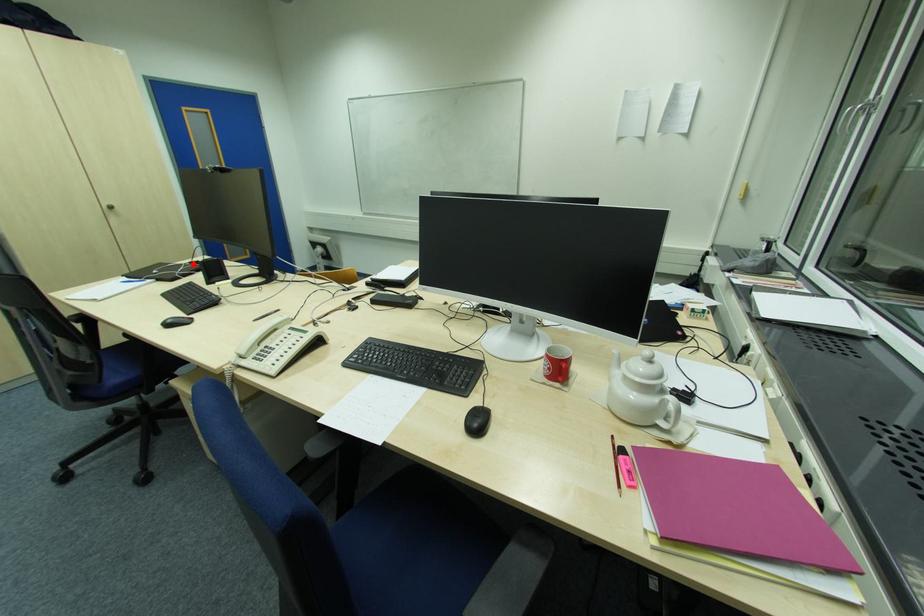
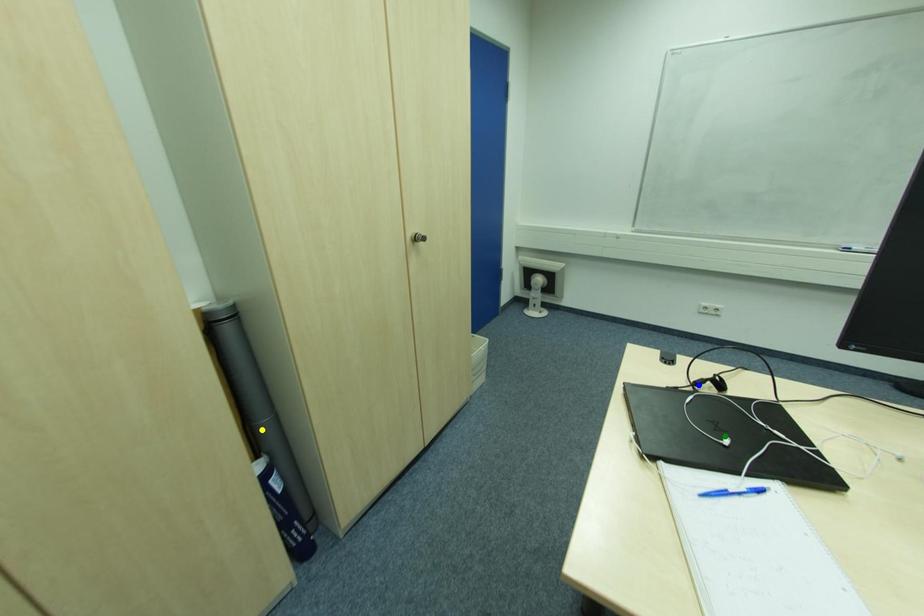
Question: I am providing you with two images of the same scene from different viewpoints. A red point is marked on the first image. You are given multiple points on the second image. Can you choose the point in image 2 that corresponds to the point in image 1?

Choices:
 (A) blue point
 (B) green point
 (C) yellow point

Answer: (A)